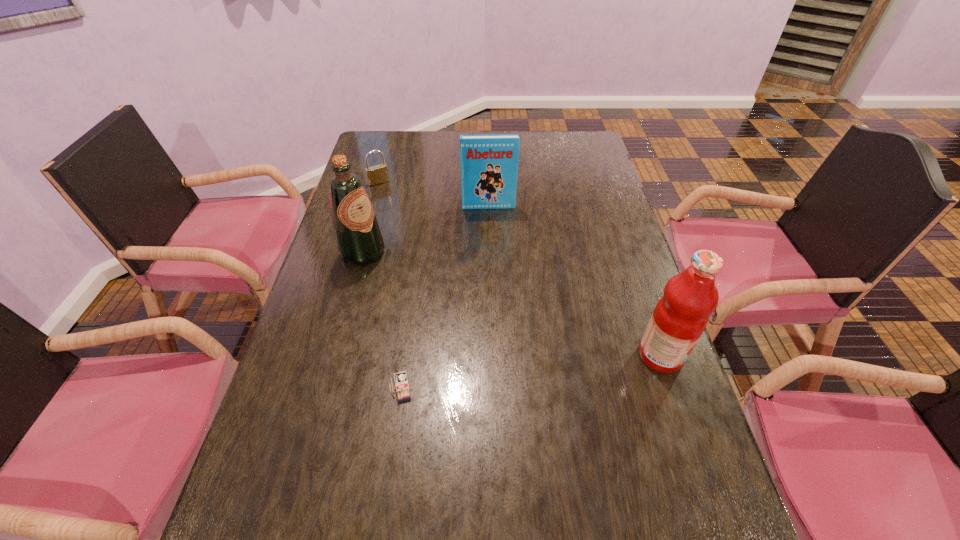
Locate an element on the screen. The image size is (960, 540). vacant position at the left edge of the desktop is located at coordinates (279, 386).

The height and width of the screenshot is (540, 960). In the image, there is a desktop. Find the location of `vacant space at the right edge`. vacant space at the right edge is located at coordinates (611, 211).

This screenshot has height=540, width=960. I want to click on free space at the far left corner of the desktop, so click(x=396, y=147).

Find the location of a particular element. The image size is (960, 540). vacant space at the far right corner of the desktop is located at coordinates (585, 133).

Where is `vacant region between the fruit juice and the padlock`? vacant region between the fruit juice and the padlock is located at coordinates (520, 269).

Find the location of a particular element. free spot between the rightmost object and the olive oil is located at coordinates (512, 305).

Locate an element on the screen. This screenshot has height=540, width=960. empty location between the book and the rightmost object is located at coordinates (575, 281).

I want to click on free space between the matchbox and the rightmost object, so click(x=531, y=372).

Locate an element on the screen. This screenshot has width=960, height=540. free point between the third object from left to right and the fruit juice is located at coordinates [531, 372].

The image size is (960, 540). In order to click on free space between the book and the rightmost object in this screenshot , I will do `click(575, 281)`.